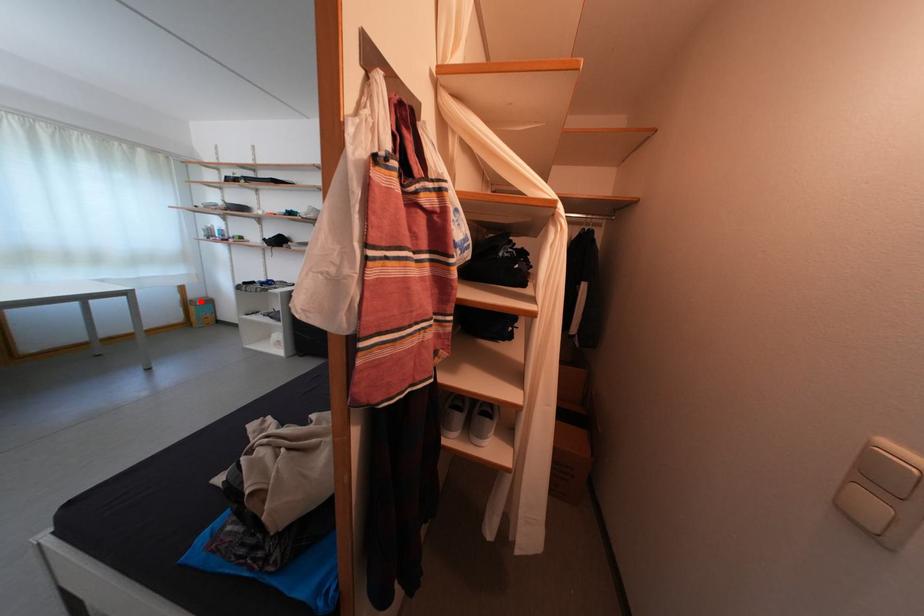
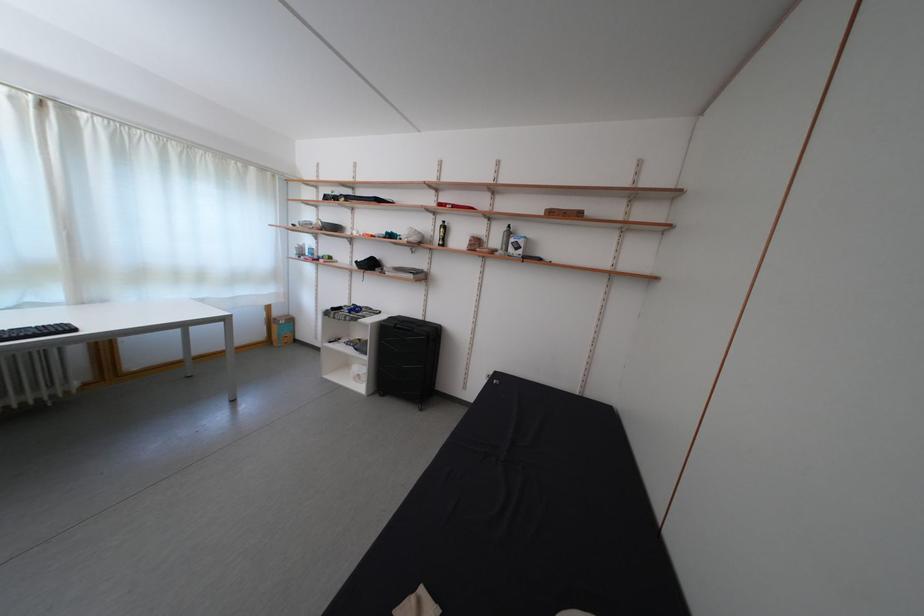
Where in the second image is the point corresponding to the highlighted location from the first image?

(285, 320)